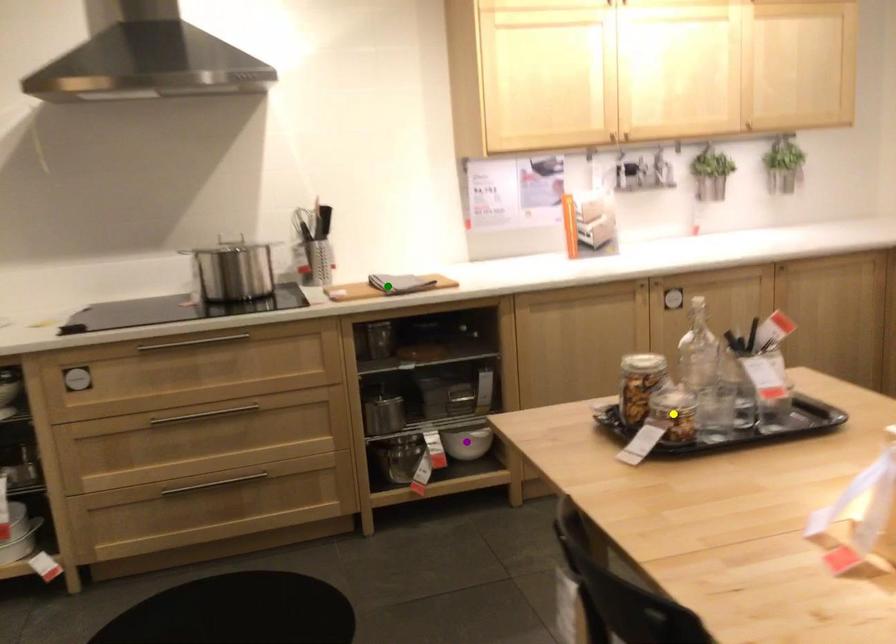
Consider the image. Order these from nearest to farthest:
green point | purple point | yellow point

yellow point < green point < purple point